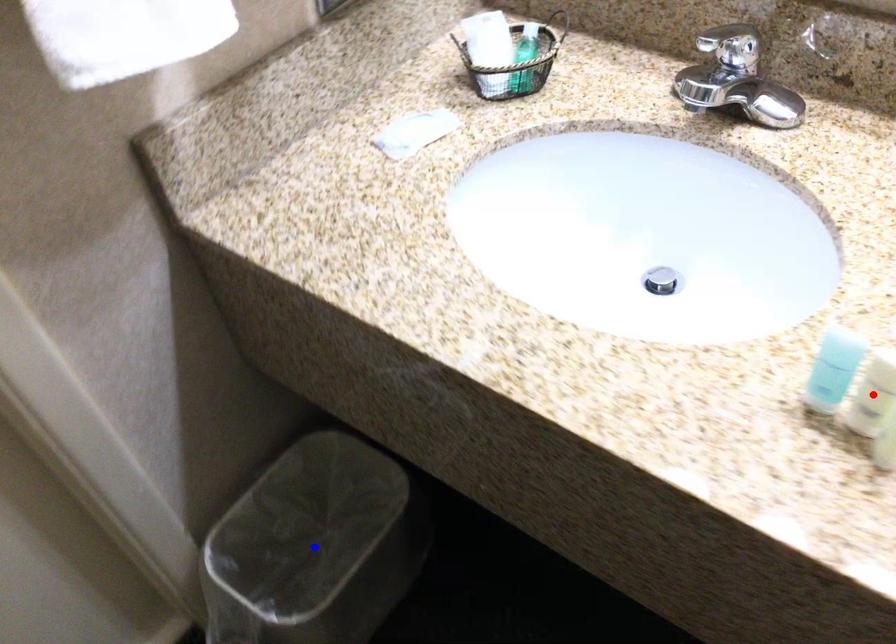
Question: Two points are marked on the image. Which point is closer to the camera?

Choices:
 (A) Blue point is closer.
 (B) Red point is closer.

Answer: (B)